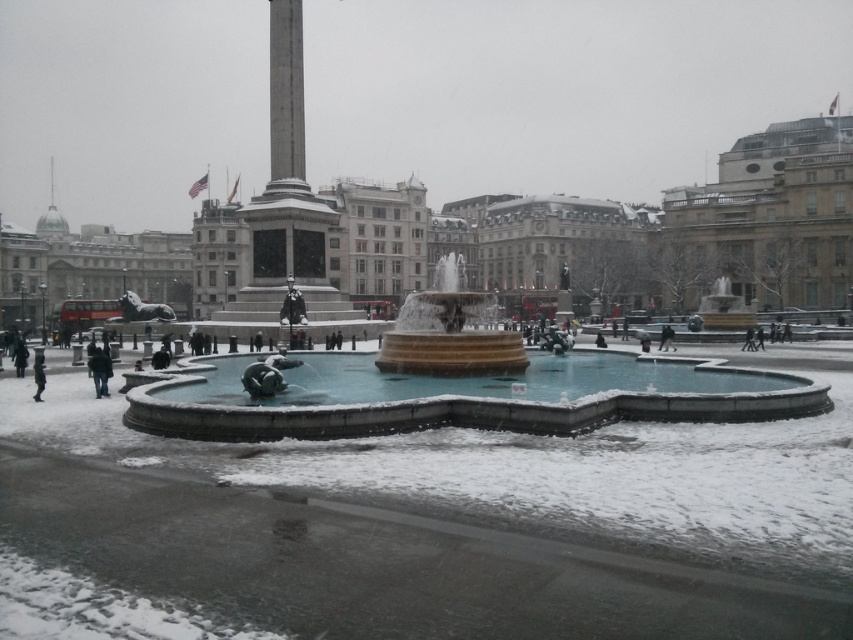
You are standing at the point with coordinates point (33, 372) and want to walk to the point with coordinates point (108, 368). According to the image, which direction should you face to move towards your destination?

You should face forward because point (108, 368) is in front of point (33, 372).